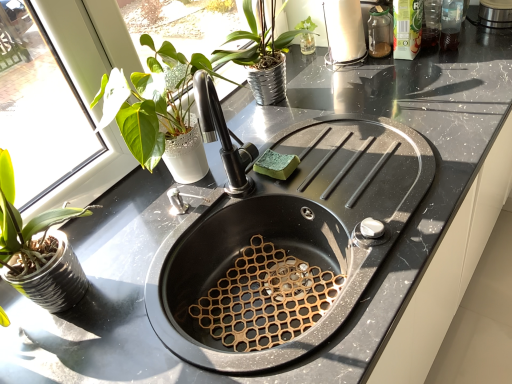
Question: Considering the relative positions of white glossy paper towel holder at upper right and black matte sink at center in the image provided, is white glossy paper towel holder at upper right behind black matte sink at center?

Choices:
 (A) yes
 (B) no

Answer: (A)

Question: From a real-world perspective, is white glossy paper towel holder at upper right under black matte sink at center?

Choices:
 (A) yes
 (B) no

Answer: (B)

Question: Would you consider white glossy paper towel holder at upper right to be distant from black matte sink at center?

Choices:
 (A) no
 (B) yes

Answer: (A)

Question: From the image's perspective, would you say white glossy paper towel holder at upper right is shown under black matte sink at center?

Choices:
 (A) no
 (B) yes

Answer: (A)

Question: Can you confirm if white glossy paper towel holder at upper right is taller than black matte sink at center?

Choices:
 (A) no
 (B) yes

Answer: (B)

Question: From the image's perspective, relative to black matte sink at center, is white glossy paper towel holder at upper right above or below?

Choices:
 (A) below
 (B) above

Answer: (B)

Question: In terms of height, does white glossy paper towel holder at upper right look taller or shorter compared to black matte sink at center?

Choices:
 (A) short
 (B) tall

Answer: (B)

Question: Is white glossy paper towel holder at upper right to the left or to the right of black matte sink at center in the image?

Choices:
 (A) right
 (B) left

Answer: (A)

Question: Is white glossy paper towel holder at upper right inside or outside of black matte sink at center?

Choices:
 (A) inside
 (B) outside

Answer: (B)

Question: Considering their positions, is green sponge at sink located in front of or behind white glossy paper towel holder at upper right?

Choices:
 (A) front
 (B) behind

Answer: (A)

Question: Considering the positions of green sponge at sink and white glossy paper towel holder at upper right in the image, is green sponge at sink wider or thinner than white glossy paper towel holder at upper right?

Choices:
 (A) thin
 (B) wide

Answer: (A)

Question: From a real-world perspective, is green sponge at sink above or below white glossy paper towel holder at upper right?

Choices:
 (A) above
 (B) below

Answer: (B)

Question: Does point (268, 165) appear closer or farther from the camera than point (330, 21)?

Choices:
 (A) farther
 (B) closer

Answer: (B)

Question: Is point (207, 130) closer or farther from the camera than point (345, 54)?

Choices:
 (A) farther
 (B) closer

Answer: (B)

Question: Considering the positions of black matte sink at center and white glossy paper towel holder at upper right in the image, is black matte sink at center wider or thinner than white glossy paper towel holder at upper right?

Choices:
 (A) thin
 (B) wide

Answer: (B)